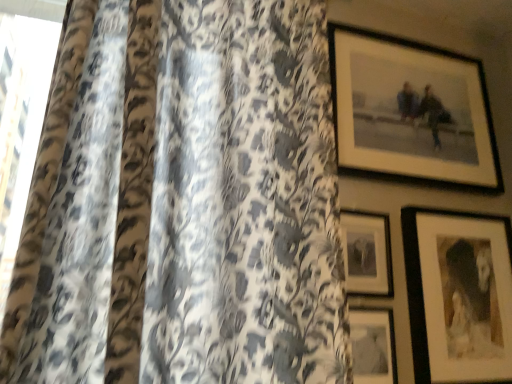
Question: From a real-world perspective, is matte black picture frame at center, positioned as the third picture frame in bottom-to-top order, on matte black picture frame at upper right, marked as the 4th picture frame in a bottom-to-top arrangement?

Choices:
 (A) yes
 (B) no

Answer: (B)

Question: Considering the relative sizes of matte black picture frame at center, positioned as the third picture frame in bottom-to-top order, and matte black picture frame at upper right, marked as the 4th picture frame in a bottom-to-top arrangement, in the image provided, is matte black picture frame at center, positioned as the third picture frame in bottom-to-top order, wider than matte black picture frame at upper right, marked as the 4th picture frame in a bottom-to-top arrangement,?

Choices:
 (A) yes
 (B) no

Answer: (B)

Question: Does matte black picture frame at center, positioned as the third picture frame in bottom-to-top order, turn towards matte black picture frame at upper right, placed as the first picture frame when sorted from top to bottom?

Choices:
 (A) no
 (B) yes

Answer: (A)

Question: Can you confirm if matte black picture frame at center, placed as the 2th picture frame when sorted from top to bottom, is bigger than matte black picture frame at upper right, placed as the first picture frame when sorted from top to bottom?

Choices:
 (A) no
 (B) yes

Answer: (A)

Question: Is matte black picture frame at center, positioned as the third picture frame in bottom-to-top order, smaller than matte black picture frame at upper right, marked as the 4th picture frame in a bottom-to-top arrangement?

Choices:
 (A) no
 (B) yes

Answer: (B)

Question: Considering the positions of matte black picture frame at lower center, positioned as the 4th picture frame in top-to-bottom order, and matte black picture frame at upper right, marked as the 4th picture frame in a bottom-to-top arrangement, in the image, is matte black picture frame at lower center, positioned as the 4th picture frame in top-to-bottom order, bigger or smaller than matte black picture frame at upper right, marked as the 4th picture frame in a bottom-to-top arrangement,?

Choices:
 (A) small
 (B) big

Answer: (A)

Question: Considering the positions of point click(x=391, y=377) and point click(x=389, y=54), is point click(x=391, y=377) closer or farther from the camera than point click(x=389, y=54)?

Choices:
 (A) closer
 (B) farther

Answer: (A)

Question: From a real-world perspective, relative to matte black picture frame at upper right, marked as the 4th picture frame in a bottom-to-top arrangement, is matte black picture frame at lower center, the 1th picture frame when ordered from bottom to top, vertically above or below?

Choices:
 (A) above
 (B) below

Answer: (B)

Question: Considering the positions of matte black picture frame at lower center, the 1th picture frame when ordered from bottom to top, and matte black picture frame at upper right, placed as the first picture frame when sorted from top to bottom, in the image, is matte black picture frame at lower center, the 1th picture frame when ordered from bottom to top, taller or shorter than matte black picture frame at upper right, placed as the first picture frame when sorted from top to bottom,?

Choices:
 (A) short
 (B) tall

Answer: (A)

Question: Is matte black picture frame at lower right, which is the 2th picture frame from bottom to top, bigger or smaller than matte black picture frame at upper right, marked as the 4th picture frame in a bottom-to-top arrangement?

Choices:
 (A) small
 (B) big

Answer: (A)

Question: Is matte black picture frame at lower right, which is the 2th picture frame from bottom to top, in front of or behind matte black picture frame at upper right, placed as the first picture frame when sorted from top to bottom, in the image?

Choices:
 (A) front
 (B) behind

Answer: (A)

Question: Looking at their shapes, would you say matte black picture frame at lower right, which is the 2th picture frame from bottom to top, is wider or thinner than matte black picture frame at upper right, placed as the first picture frame when sorted from top to bottom?

Choices:
 (A) wide
 (B) thin

Answer: (A)

Question: In terms of height, does matte black picture frame at lower right, arranged as the 3th picture frame when viewed from the top, look taller or shorter compared to matte black picture frame at upper right, marked as the 4th picture frame in a bottom-to-top arrangement?

Choices:
 (A) short
 (B) tall

Answer: (A)

Question: From the image's perspective, relative to matte black picture frame at center, placed as the 2th picture frame when sorted from top to bottom, is matte black picture frame at lower center, the 1th picture frame when ordered from bottom to top, above or below?

Choices:
 (A) above
 (B) below

Answer: (B)

Question: Would you say matte black picture frame at lower center, positioned as the 4th picture frame in top-to-bottom order, is to the left or to the right of matte black picture frame at center, positioned as the third picture frame in bottom-to-top order, in the picture?

Choices:
 (A) left
 (B) right

Answer: (A)